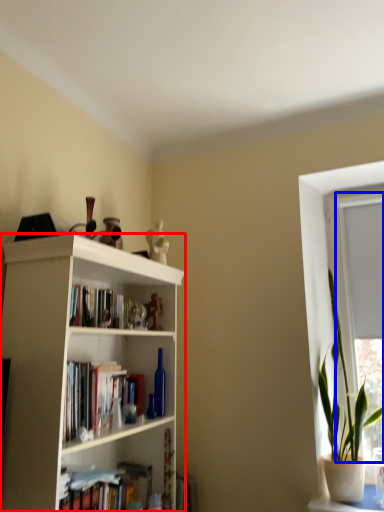
Question: Which object appears farthest to the camera in this image, bookcase (highlighted by a red box) or window frame (highlighted by a blue box)?

Choices:
 (A) bookcase
 (B) window frame

Answer: (B)